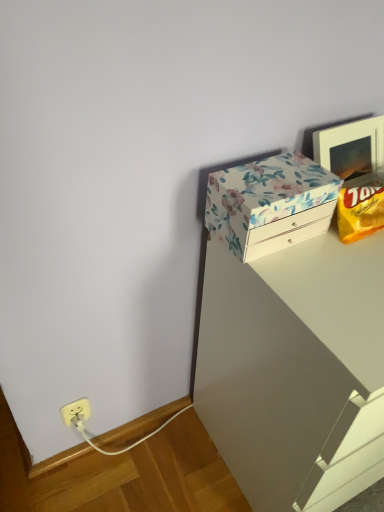
Question: Does floral paper-covered box at upper right come in front of white glossy vanity at upper right?

Choices:
 (A) yes
 (B) no

Answer: (B)

Question: From the image's perspective, is floral paper-covered box at upper right under white glossy vanity at upper right?

Choices:
 (A) yes
 (B) no

Answer: (B)

Question: Can you confirm if floral paper-covered box at upper right is wider than white glossy vanity at upper right?

Choices:
 (A) no
 (B) yes

Answer: (A)

Question: Is floral paper-covered box at upper right outside white glossy vanity at upper right?

Choices:
 (A) no
 (B) yes

Answer: (B)

Question: Considering the relative sizes of floral paper-covered box at upper right and white glossy vanity at upper right in the image provided, is floral paper-covered box at upper right thinner than white glossy vanity at upper right?

Choices:
 (A) yes
 (B) no

Answer: (A)

Question: Is floral paper-covered box at upper right in contact with white glossy vanity at upper right?

Choices:
 (A) yes
 (B) no

Answer: (B)

Question: Is the position of yellow matte chip bag at upper right less distant than that of white glossy vanity at upper right?

Choices:
 (A) no
 (B) yes

Answer: (A)

Question: From a real-world perspective, does yellow matte chip bag at upper right stand above white glossy vanity at upper right?

Choices:
 (A) yes
 (B) no

Answer: (A)

Question: Considering the relative sizes of yellow matte chip bag at upper right and white glossy vanity at upper right in the image provided, is yellow matte chip bag at upper right wider than white glossy vanity at upper right?

Choices:
 (A) yes
 (B) no

Answer: (B)

Question: From a real-world perspective, is yellow matte chip bag at upper right located beneath white glossy vanity at upper right?

Choices:
 (A) yes
 (B) no

Answer: (B)

Question: Can you confirm if yellow matte chip bag at upper right is shorter than white glossy vanity at upper right?

Choices:
 (A) no
 (B) yes

Answer: (B)

Question: From the image's perspective, does yellow matte chip bag at upper right appear higher than white glossy vanity at upper right?

Choices:
 (A) no
 (B) yes

Answer: (B)

Question: From the image's perspective, is yellow matte chip bag at upper right above floral paper-covered box at upper right?

Choices:
 (A) no
 (B) yes

Answer: (A)